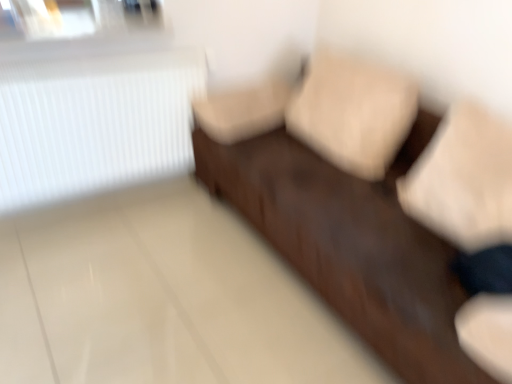
Question: Is white ribbed radiator at upper left oriented away from dark brown leather couch at center?

Choices:
 (A) yes
 (B) no

Answer: (B)

Question: From a real-world perspective, does white ribbed radiator at upper left sit lower than dark brown leather couch at center?

Choices:
 (A) yes
 (B) no

Answer: (B)

Question: From a real-world perspective, is white ribbed radiator at upper left over dark brown leather couch at center?

Choices:
 (A) no
 (B) yes

Answer: (B)

Question: Is white ribbed radiator at upper left facing towards dark brown leather couch at center?

Choices:
 (A) no
 (B) yes

Answer: (B)

Question: Is white ribbed radiator at upper left completely or partially outside of dark brown leather couch at center?

Choices:
 (A) yes
 (B) no

Answer: (A)

Question: Is white ribbed radiator at upper left far away from dark brown leather couch at center?

Choices:
 (A) no
 (B) yes

Answer: (A)

Question: Considering the relative sizes of dark brown leather couch at center and white ribbed radiator at upper left in the image provided, is dark brown leather couch at center taller than white ribbed radiator at upper left?

Choices:
 (A) yes
 (B) no

Answer: (A)

Question: Is dark brown leather couch at center further to the viewer compared to white ribbed radiator at upper left?

Choices:
 (A) yes
 (B) no

Answer: (B)

Question: From a real-world perspective, is dark brown leather couch at center over white ribbed radiator at upper left?

Choices:
 (A) yes
 (B) no

Answer: (B)

Question: Would you say dark brown leather couch at center is outside white ribbed radiator at upper left?

Choices:
 (A) yes
 (B) no

Answer: (A)

Question: Are dark brown leather couch at center and white ribbed radiator at upper left making contact?

Choices:
 (A) no
 (B) yes

Answer: (A)

Question: Is dark brown leather couch at center to the left of white ribbed radiator at upper left from the viewer's perspective?

Choices:
 (A) yes
 (B) no

Answer: (B)

Question: In the image, is white ribbed radiator at upper left on the left side or the right side of dark brown leather couch at center?

Choices:
 (A) left
 (B) right

Answer: (A)